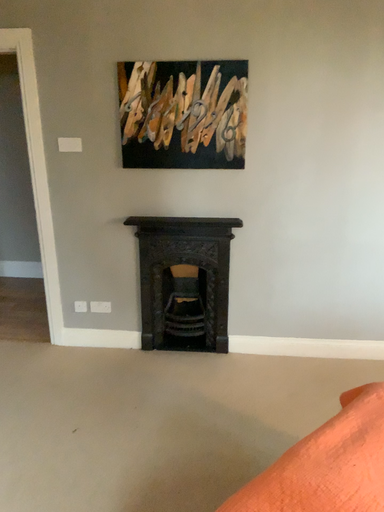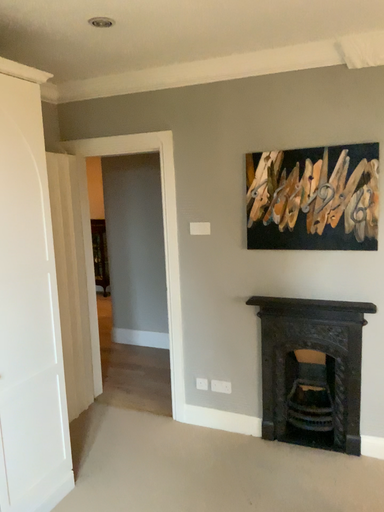
Question: How did the camera likely rotate when shooting the video?

Choices:
 (A) rotated left
 (B) rotated right

Answer: (A)